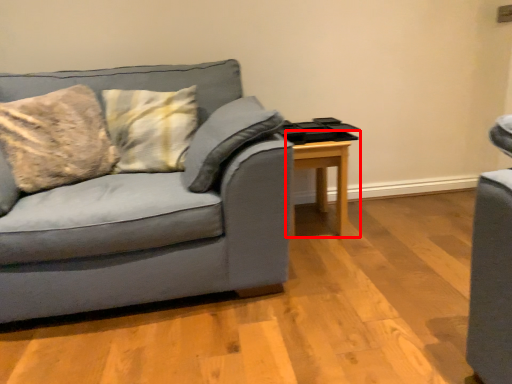
Question: From the image's perspective, where is table (annotated by the red box) located in relation to studio couch in the image?

Choices:
 (A) below
 (B) above

Answer: (A)